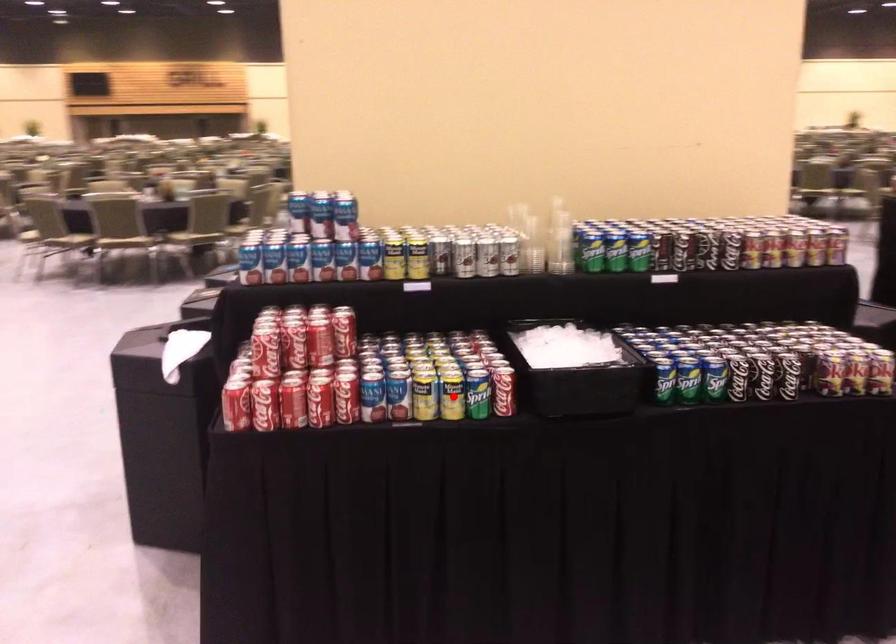
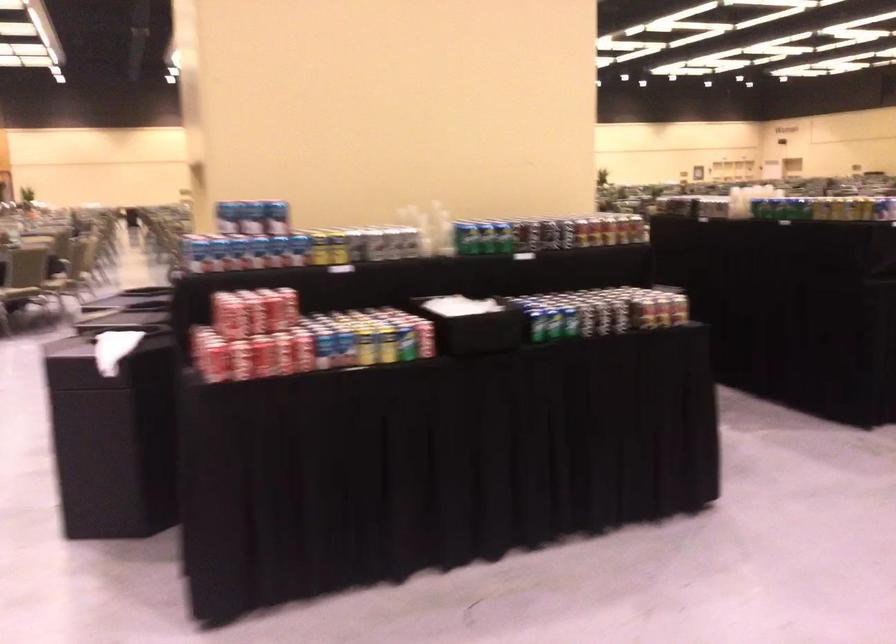
Locate, in the second image, the point that corresponds to the highlighted location in the first image.

(386, 345)